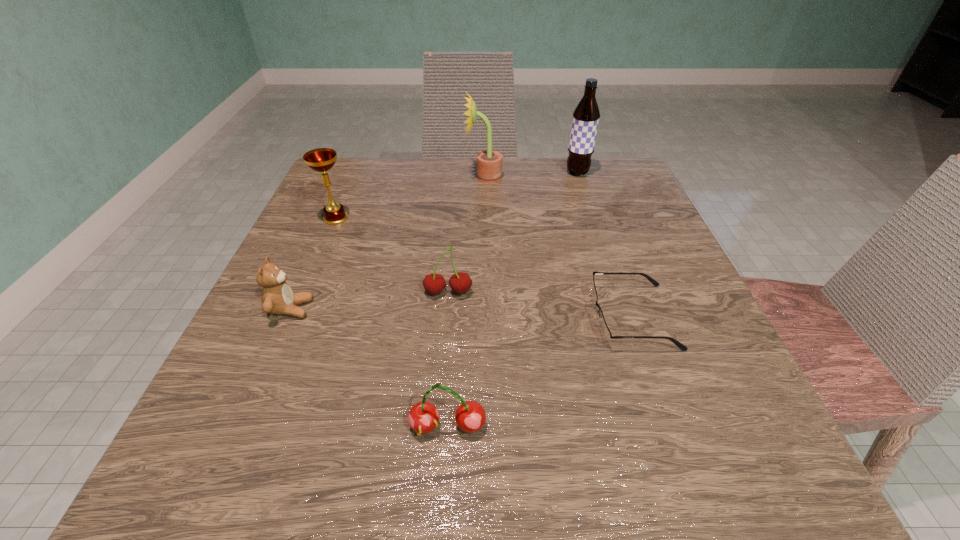
The width and height of the screenshot is (960, 540). What are the coordinates of `root beer` in the screenshot? It's located at (586, 115).

This screenshot has width=960, height=540. Find the location of `sunflower`. sunflower is located at coordinates (489, 163).

I want to click on chalice, so click(x=321, y=159).

Locate an element on the screen. the fifth shortest object is located at coordinates (321, 159).

The height and width of the screenshot is (540, 960). In order to click on the farther cherry in this screenshot , I will do `click(460, 283)`.

I want to click on teddy bear, so click(277, 296).

In order to click on the nearer cherry in this screenshot , I will do `click(470, 416)`.

Find the location of a particular element. spectacles is located at coordinates (x=606, y=335).

The height and width of the screenshot is (540, 960). What are the coordinates of `free space located on the front of the root beer` in the screenshot? It's located at (600, 241).

What are the coordinates of `free space located 0.210m on the face of the sunflower` in the screenshot? It's located at (377, 177).